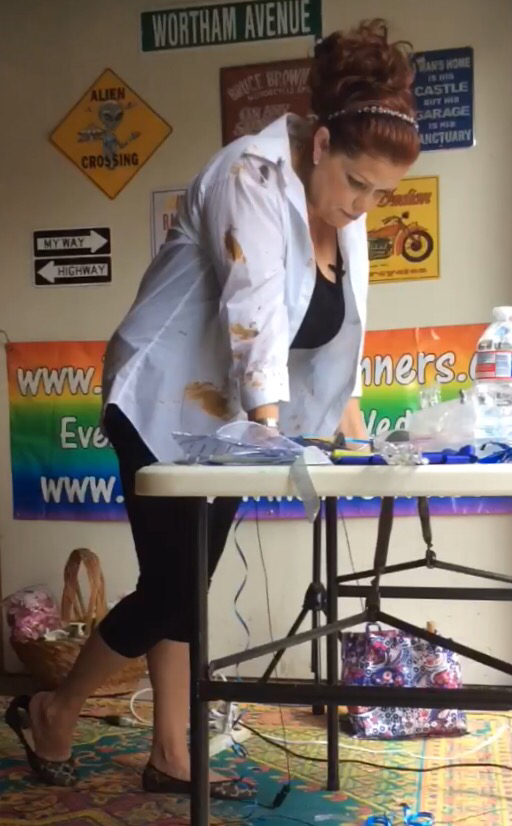
You are a GUI agent. You are given a task and a screenshot of the screen. Output one action in this format:
    pyautogui.click(x=<x>, y=<y>)
    Task: Click on the basket
    This screenshot has width=512, height=826.
    Given the screenshot: What is the action you would take?
    pyautogui.click(x=98, y=620)